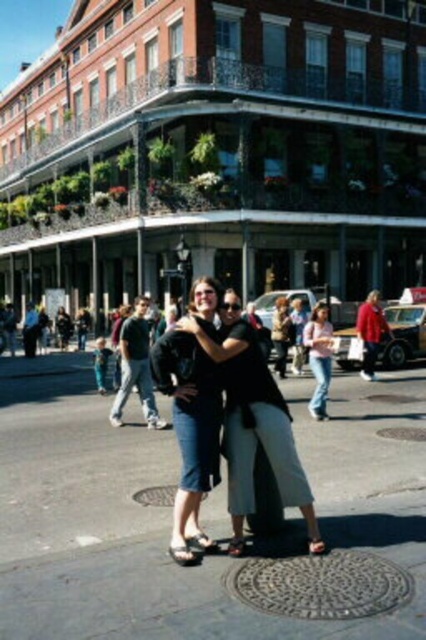
You are a photographer trying to capture a candid shot of the dark gray jeans at center and the pink fabric shirt at right. To ensure both subjects are in frame, should you adjust your camera to focus more to the left or the right?

Since the dark gray jeans at center is to the left of the pink fabric shirt at right, you should focus your camera more to the left to include both subjects in the frame.

You are a photographer standing at the corner of the street. You want to take a photo of the black fabric couple at center so that they are in focus. Your camera has a depth of field that can sharply focus objects within 20 feet. Will the couple be in focus?

The black fabric couple at center is 24.68 feet away from the camera. Since the depth of field can only focus within 20 feet, the couple will not be in focus.